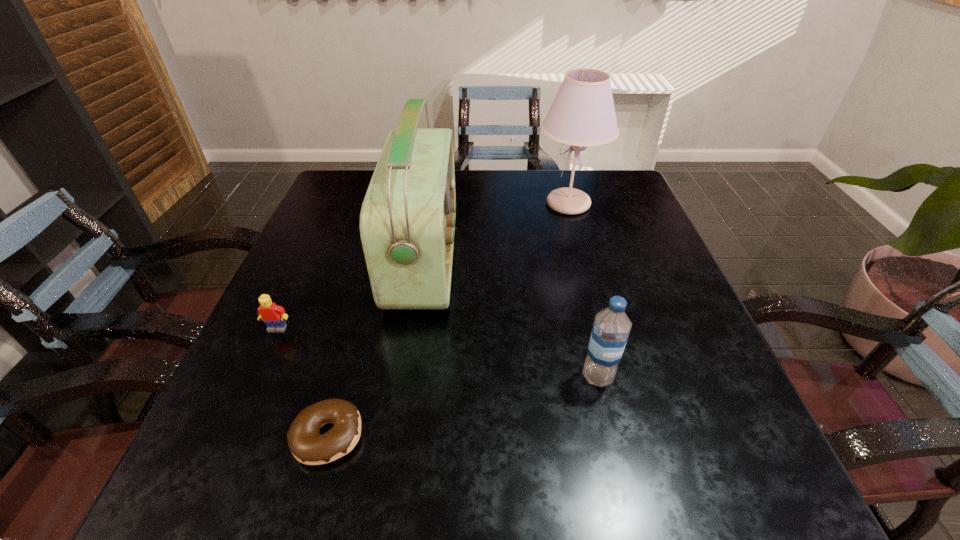
Find the location of `free region located on the label of the third tallest object`. free region located on the label of the third tallest object is located at coordinates (610, 428).

Find the location of `free space located 0.200m on the front-facing side of the fourth tallest object`. free space located 0.200m on the front-facing side of the fourth tallest object is located at coordinates (233, 427).

Identify the location of free space located on the back of the nearest object. Image resolution: width=960 pixels, height=540 pixels. pos(371,281).

You are a GUI agent. You are given a task and a screenshot of the screen. Output one action in this format:
    pyautogui.click(x=<x>, y=<y>)
    Task: Click on the lampshade that is at the far edge
    This screenshot has height=540, width=960.
    Given the screenshot: What is the action you would take?
    pyautogui.click(x=582, y=114)

Identify the location of radio receiver that is at the far edge. The image size is (960, 540). (x=407, y=221).

Where is `object at the near edge`? The width and height of the screenshot is (960, 540). object at the near edge is located at coordinates (308, 446).

The height and width of the screenshot is (540, 960). I want to click on Lego present at the left edge, so coord(273,315).

Identify the location of doughnut that is at the left edge. (308, 446).

Find the location of a particular element. The height and width of the screenshot is (540, 960). object that is positioned at the right edge is located at coordinates (582, 114).

Locate an element on the screen. This screenshot has width=960, height=540. object present at the near left corner is located at coordinates (308, 446).